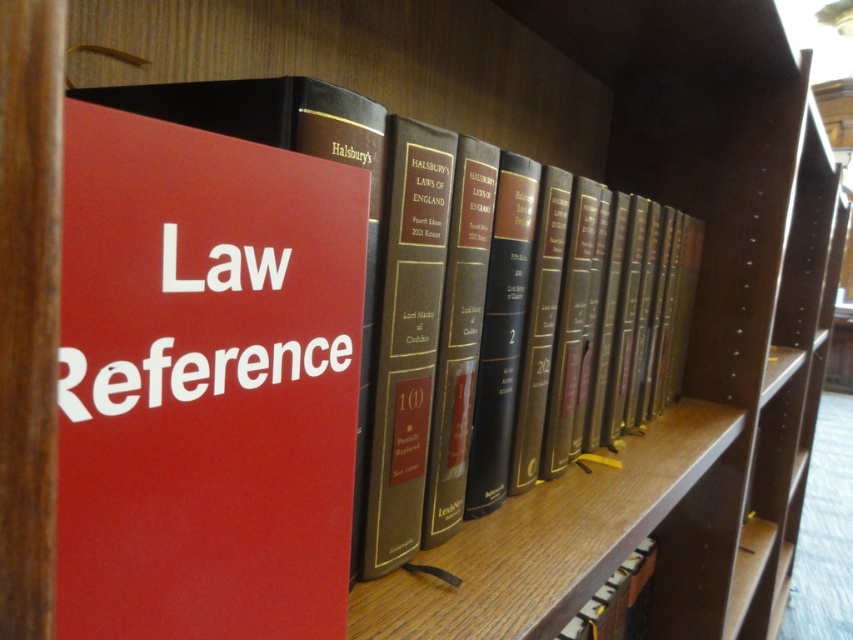
You are organizing a library and need to place the red matte sign at center and the hardcover book at center on a shelf. Given their sizes, which item should you place first to ensure proper arrangement?

The red matte sign at center has a smaller size compared to the hardcover book at center, so you should place the hardcover book at center first to accommodate its larger size and then position the smaller sign accordingly.

You are organizing books on a shelf and need to place a new book at the exact center of the shelf. The shelf has a coordinate system where the bottom left corner is at point 0,0 and the top right corner is at 1,1. You see the point (204, 384) on the shelf. Is this point suitable for placing the new book at the center?

The point (204, 384) indicates the matte red book at center, so yes, placing the new book at this point would center it on the shelf.

You are organizing a library and need to place both the matte red book at center and the red matte sign at center on a shelf. Given their heights, which one should be placed first to ensure stability?

The matte red book at center has a greater height compared to the red matte sign at center, so it should be placed first on the lower shelf to ensure stability.